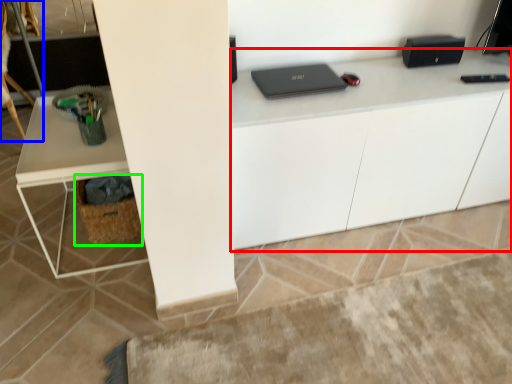
Question: Which object is positioned farthest from computer desk (highlighted by a red box)? Select from swivel chair (highlighted by a blue box) and basket (highlighted by a green box).

Choices:
 (A) swivel chair
 (B) basket

Answer: (A)